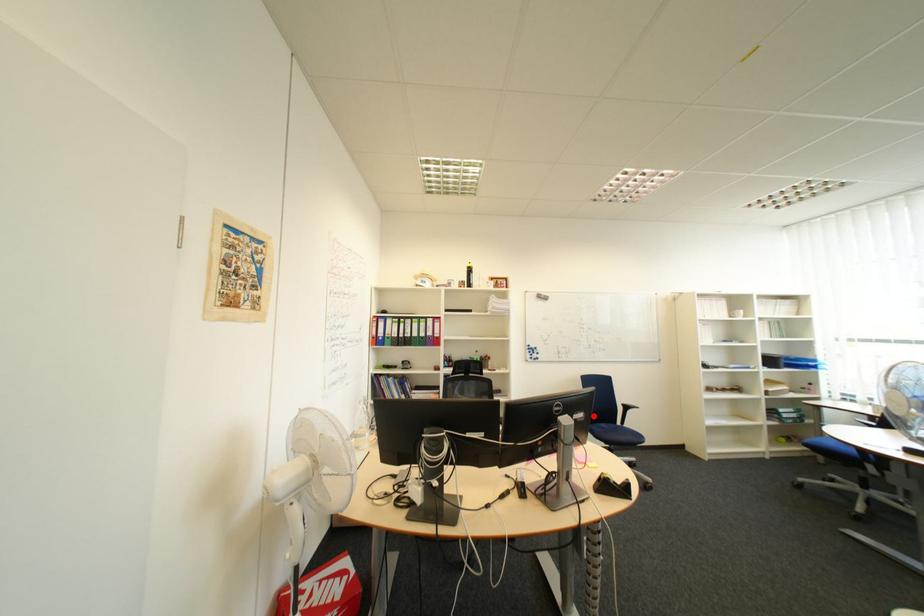
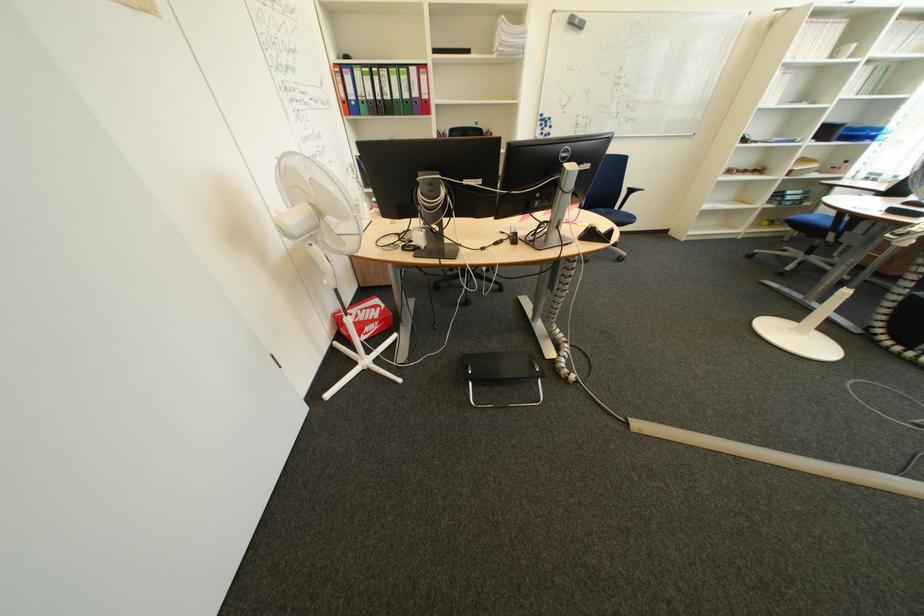
Question: I am providing you with two images of the same scene from different viewpoints. In image1, a red point is highlighted. Considering the same 3D point in image2, which of the following is correct?

Choices:
 (A) It is closer
 (B) It is farther

Answer: (A)